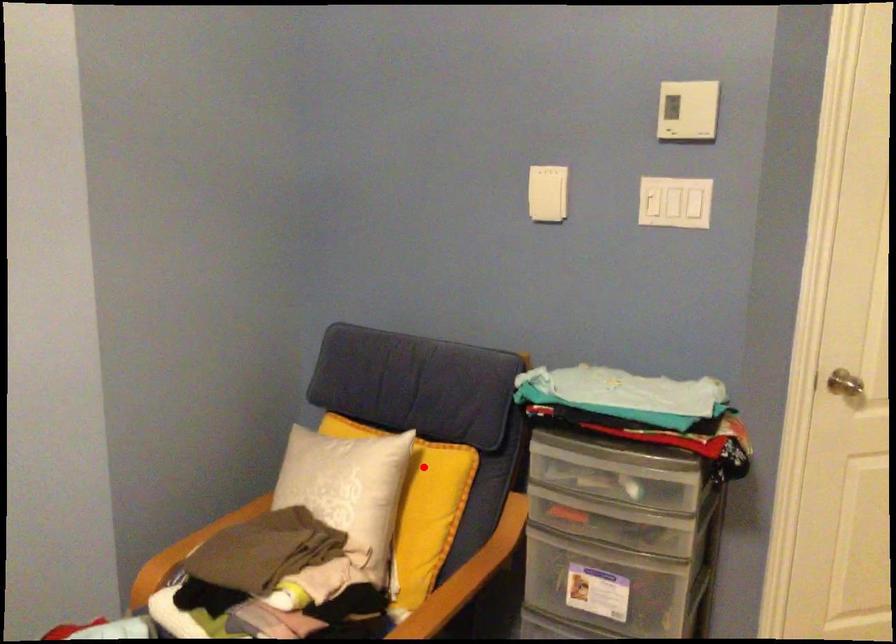
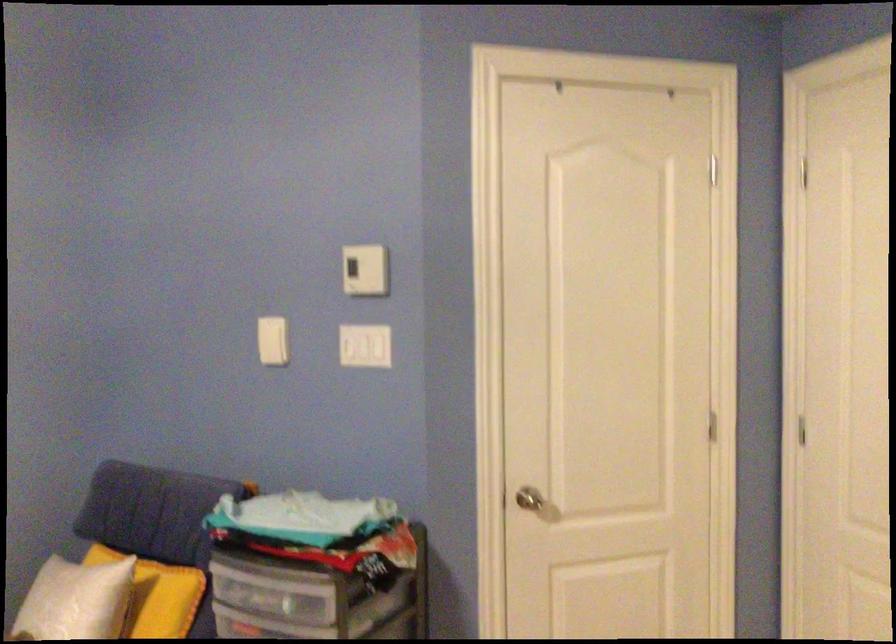
Question: I am providing you with two images of the same scene from different viewpoints. A red point is marked on the first image. Is the red point's position out of view in image 2?

Choices:
 (A) Yes
 (B) No

Answer: (B)